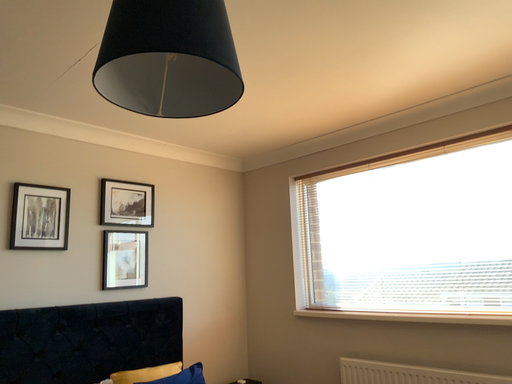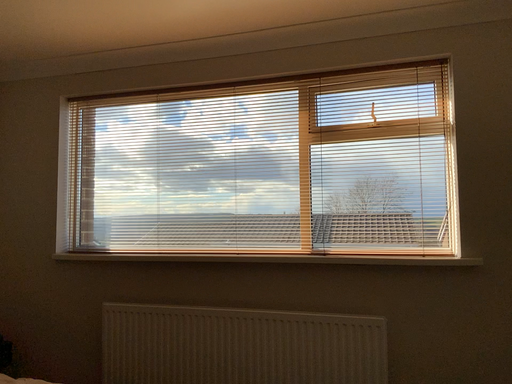
Question: Which way did the camera rotate in the video?

Choices:
 (A) rotated left
 (B) rotated right

Answer: (B)